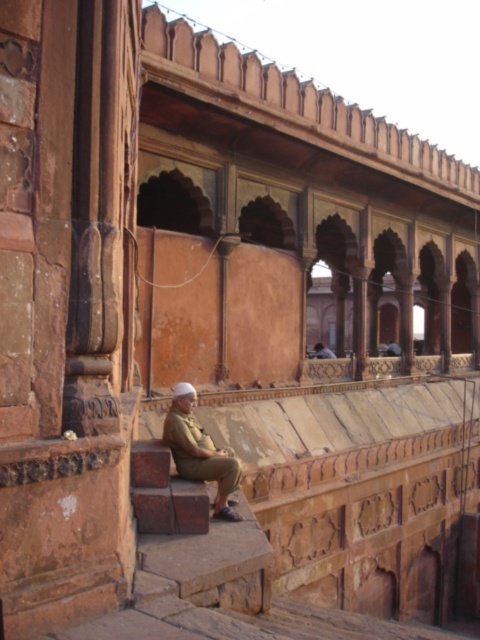
Question: Which point is farther to the camera?

Choices:
 (A) (319, 353)
 (B) (212, 451)

Answer: (A)

Question: Can you confirm if khaki uniform at lower center is positioned to the left of khaki uniform at center?

Choices:
 (A) yes
 (B) no

Answer: (A)

Question: Does khaki uniform at lower center have a smaller size compared to khaki uniform at center?

Choices:
 (A) yes
 (B) no

Answer: (A)

Question: Can you confirm if khaki uniform at lower center is positioned above khaki uniform at center?

Choices:
 (A) no
 (B) yes

Answer: (A)